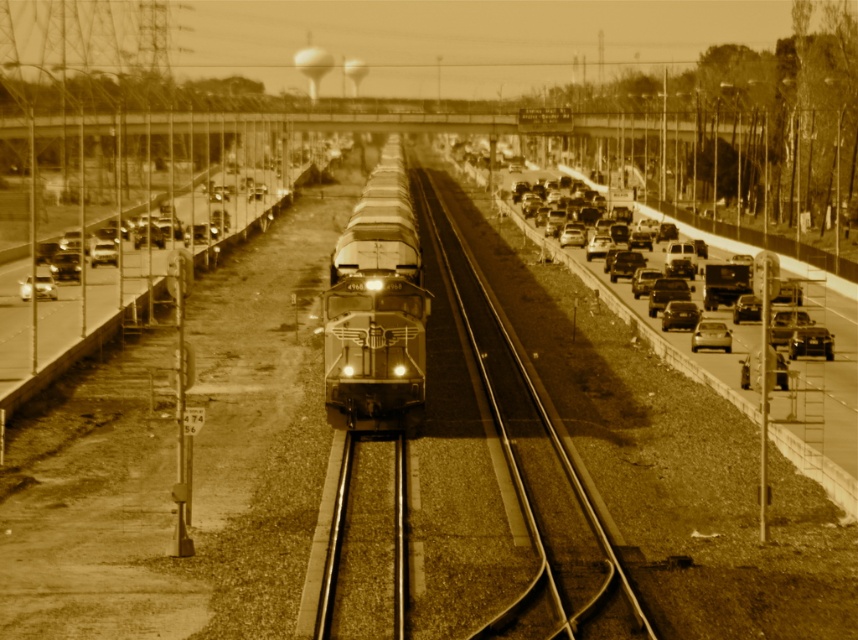
You are a pedestrian standing on the highway shoulder. You see the shiny black locomotive at center and the shiny silver sedan at center right. Which object is closer to you?

The shiny black locomotive at center is closer to you because it is in front of the shiny silver sedan at center right, meaning it is positioned nearer in the scene.

Consider the image. You are a photographer trying to capture both the shiny black sedan at right and the matte black sedan at right in a single shot. Given that your camera can only focus on objects within a 2.5 meter width, will both cars fit side by side in your frame?

The shiny black sedan at right is wider than the matte black sedan at right. Since the camera can only focus on objects within a 2.5 meter width, the total width of both cars combined may exceed this limit. However, without knowing the exact widths of each car, it is impossible to determine if they will fit side by side in the frame.

You are a pedestrian standing on the grassy area next to the railway track. You see a shiny black sedan at right. Which direction should you move to stay away from the highway?

The shiny black sedan at right is located at point (810, 342), which is on the right side of the image. To stay away from the highway, you should move towards the left or towards the railway tracks since the highway is on the right side with vehicles like the shiny black sedan at right.